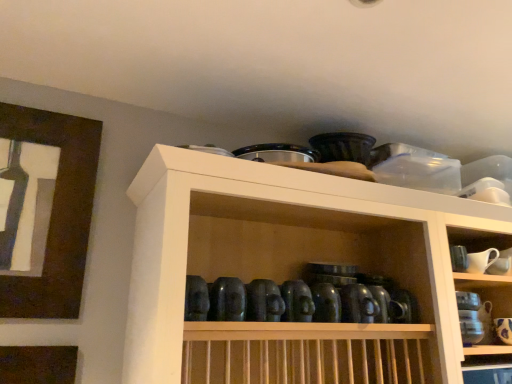
Question: Should I look upward or downward to see brown wooden picture frame at upper left?

Choices:
 (A) up
 (B) down

Answer: (B)

Question: Can you confirm if white ceramic pitcher at upper right, which is counted as the 2th tableware, starting from the right, is shorter than matte black bowls at upper center?

Choices:
 (A) yes
 (B) no

Answer: (A)

Question: Is the depth of white ceramic pitcher at upper right, the second tableware from the bottom, less than that of matte black bowls at upper center?

Choices:
 (A) no
 (B) yes

Answer: (A)

Question: From the image's perspective, does white ceramic pitcher at upper right, the second tableware from the bottom, appear lower than matte black bowls at upper center?

Choices:
 (A) yes
 (B) no

Answer: (B)

Question: Is white ceramic pitcher at upper right, which is counted as the 2th tableware, starting from the right, behind matte black bowls at upper center?

Choices:
 (A) yes
 (B) no

Answer: (A)

Question: Can you confirm if white ceramic pitcher at upper right, the first tableware viewed from the top, is smaller than matte black bowls at upper center?

Choices:
 (A) yes
 (B) no

Answer: (A)

Question: Does white ceramic pitcher at upper right, the first tableware viewed from the top, have a lesser width compared to matte black bowls at upper center?

Choices:
 (A) no
 (B) yes

Answer: (B)

Question: Does matte black bowls at upper center appear on the right side of white ceramic pitcher at upper right, which is counted as the 2th tableware, starting from the right?

Choices:
 (A) no
 (B) yes

Answer: (A)

Question: Can you confirm if matte black bowls at upper center is thinner than white ceramic pitcher at upper right, the first tableware viewed from the top?

Choices:
 (A) no
 (B) yes

Answer: (A)

Question: Is matte black bowls at upper center positioned with its back to white ceramic pitcher at upper right, the second tableware from the bottom?

Choices:
 (A) no
 (B) yes

Answer: (B)

Question: From the image's perspective, is matte black bowls at upper center under white ceramic pitcher at upper right, which is counted as the 2th tableware, starting from the right?

Choices:
 (A) yes
 (B) no

Answer: (A)

Question: Is matte black bowls at upper center closer to the viewer compared to white ceramic pitcher at upper right, which is counted as the 2th tableware, starting from the right?

Choices:
 (A) no
 (B) yes

Answer: (B)

Question: Would you say matte black bowls at upper center is outside white ceramic pitcher at upper right, the second tableware from the bottom?

Choices:
 (A) yes
 (B) no

Answer: (A)

Question: Can you confirm if white ceramic pitcher at upper right, the first tableware viewed from the top, is positioned to the right of brown wooden picture frame at upper left?

Choices:
 (A) yes
 (B) no

Answer: (A)